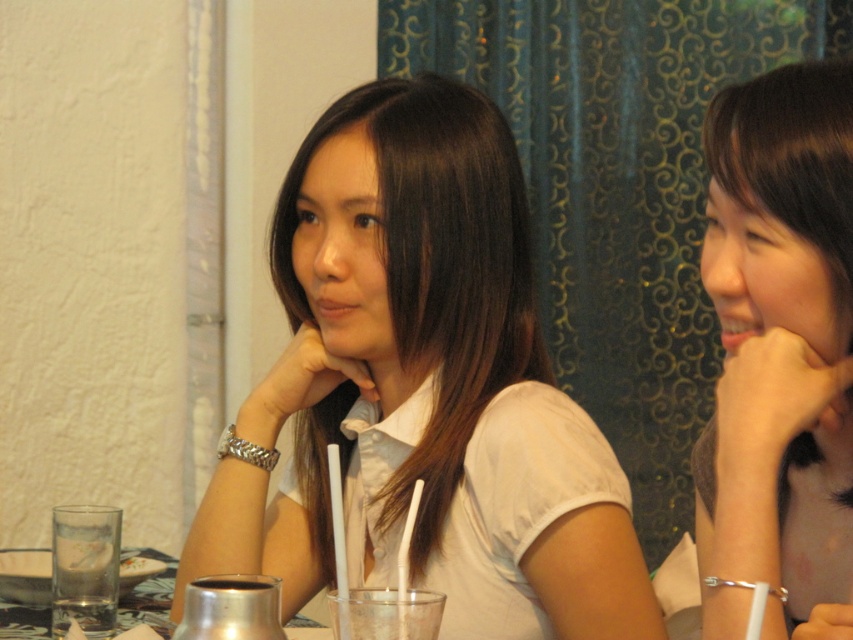
Question: Which object appears closest to the camera in this image?

Choices:
 (A) white matte shirt at center
 (B) white matte shirt at upper right

Answer: (B)

Question: Can you confirm if white matte shirt at center is positioned above metallic silver carafe at lower center?

Choices:
 (A) no
 (B) yes

Answer: (B)

Question: Among these points, which one is farthest from the camera?

Choices:
 (A) (561, 531)
 (B) (126, 627)

Answer: (B)

Question: Is white matte shirt at center bigger than metallic silver carafe at lower center?

Choices:
 (A) yes
 (B) no

Answer: (A)

Question: Which of the following is the farthest from the observer?

Choices:
 (A) white matte shirt at upper right
 (B) white matte shirt at center

Answer: (B)

Question: Can you confirm if white matte shirt at upper right is bigger than metallic silver carafe at lower center?

Choices:
 (A) no
 (B) yes

Answer: (B)